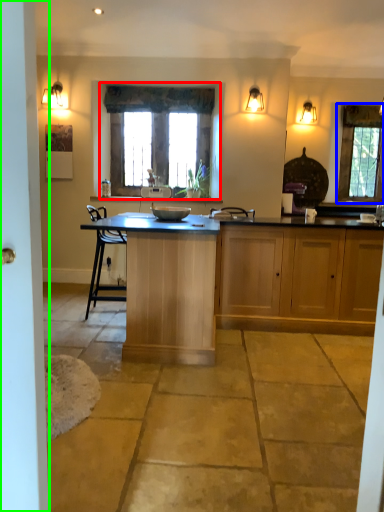
Question: Which object is positioned farthest from window (highlighted by a red box)? Select from window (highlighted by a blue box) and screen door (highlighted by a green box).

Choices:
 (A) window
 (B) screen door

Answer: (B)